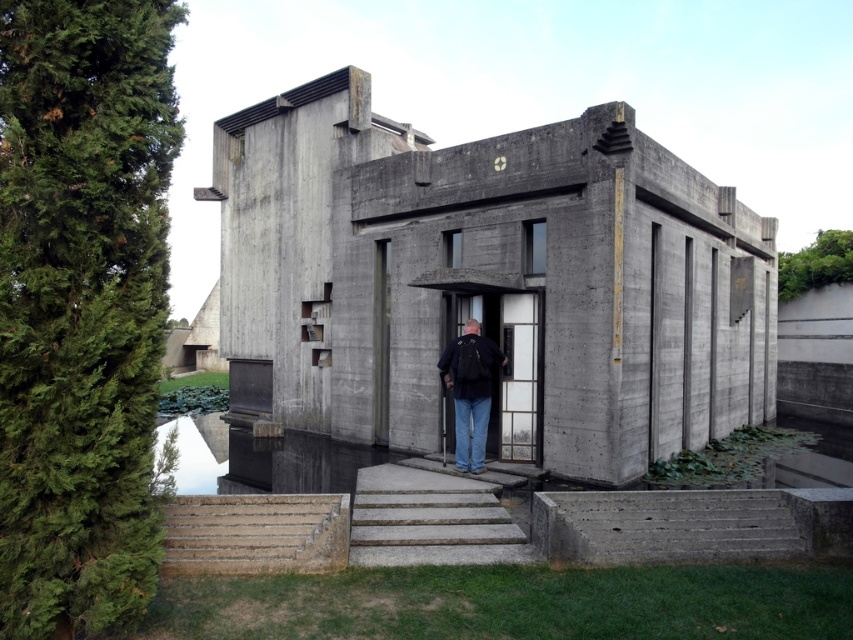
Can you confirm if concrete stairs at lower center is wider than concrete/steps at lower left?

Correct, the width of concrete stairs at lower center exceeds that of concrete/steps at lower left.

Can you confirm if concrete stairs at lower center is positioned above concrete/steps at lower left?

No, concrete stairs at lower center is not above concrete/steps at lower left.

Image resolution: width=853 pixels, height=640 pixels. Describe the element at coordinates (663, 525) in the screenshot. I see `concrete stairs at lower center` at that location.

You are a GUI agent. You are given a task and a screenshot of the screen. Output one action in this format:
    pyautogui.click(x=<x>, y=<y>)
    Task: Click on the concrete stairs at lower center
    
    Given the screenshot: What is the action you would take?
    pyautogui.click(x=663, y=525)

Who is taller, concrete stairs at lower center or gray concrete stairs at center?

concrete stairs at lower center is taller.

Between point (692, 512) and point (418, 488), which one is positioned in front?

Point (692, 512)

Where is `concrete stairs at lower center`? concrete stairs at lower center is located at coordinates (663, 525).

Is gray concrete stairs at center wider than dark blue jeans at center?

Indeed, gray concrete stairs at center has a greater width compared to dark blue jeans at center.

In the scene shown: Between gray concrete stairs at center and dark blue jeans at center, which one has less height?

gray concrete stairs at center is shorter.

Does point (503, 529) come behind point (453, 372)?

No, it is not.

The height and width of the screenshot is (640, 853). Identify the location of gray concrete stairs at center. (431, 520).